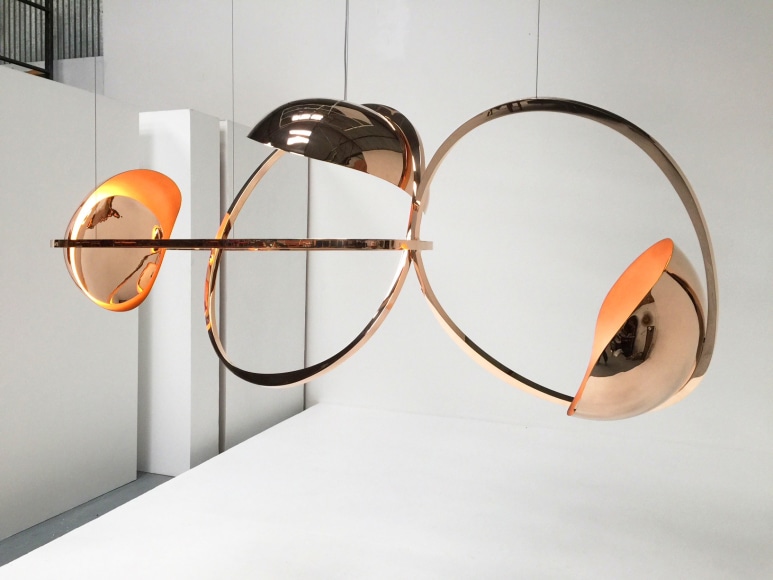
I want to click on reflected lights, so click(x=302, y=119), click(x=298, y=134), click(x=301, y=143).